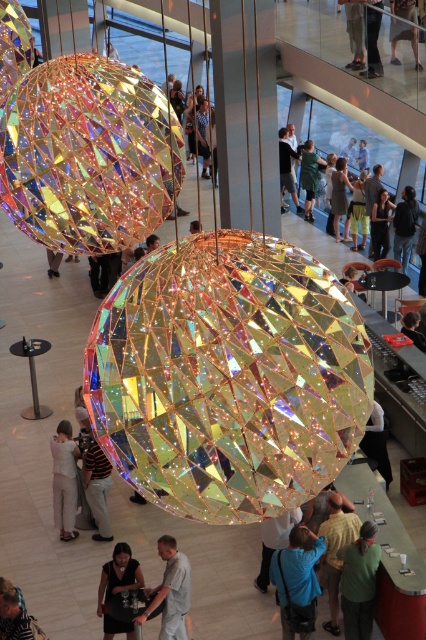
Question: Which object is farther from the camera taking this photo?

Choices:
 (A) blue fabric jacket at lower center
 (B) striped shirt at center

Answer: (B)

Question: Estimate the real-world distances between objects in this image. Which object is closer to the blue fabric jacket at lower center?

Choices:
 (A) striped shirt at center
 (B) green matte sweater at lower center
 (C) green fabric shirt at center
 (D) matte black phone at center

Answer: (B)

Question: Does dark brown leather jacket at center appear on the right side of matte black phone at center?

Choices:
 (A) yes
 (B) no

Answer: (A)

Question: Does striped shirt at center have a larger size compared to blue fabric shirt at center?

Choices:
 (A) yes
 (B) no

Answer: (B)

Question: Estimate the real-world distances between objects in this image. Which object is farther from the green fabric shirt at center?

Choices:
 (A) light beige shirt at center
 (B) blue fabric shirt at center
 (C) dark brown leather jacket at center

Answer: (C)

Question: Is blue fabric jacket at lower center above striped shirt at center?

Choices:
 (A) no
 (B) yes

Answer: (A)